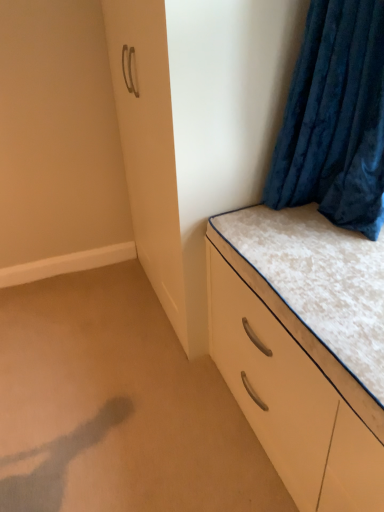
Where is `free space below velvet blue curtain at upper right (from a real-world perspective)`? The width and height of the screenshot is (384, 512). free space below velvet blue curtain at upper right (from a real-world perspective) is located at coordinates (325, 221).